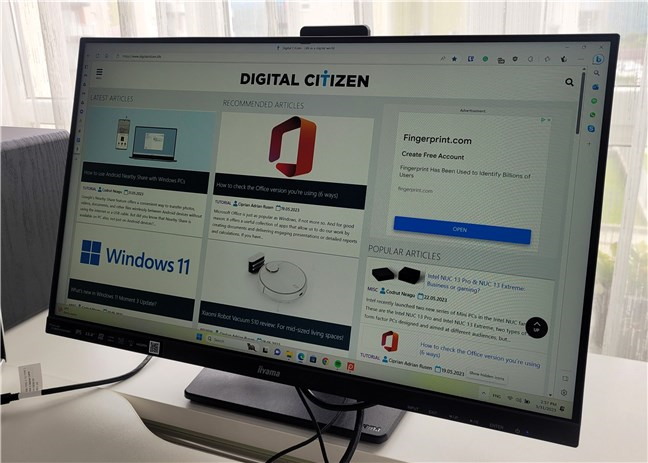
Locate an element on the screen. The height and width of the screenshot is (463, 648). monitor is located at coordinates (356, 33).